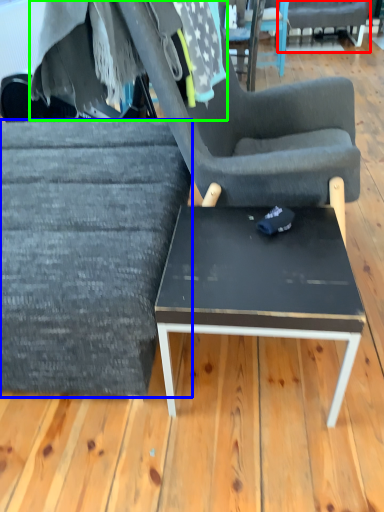
Question: Based on their relative distances, which object is farther from chair (highlighted by a red box)? Choose from chair (highlighted by a blue box) and fabric (highlighted by a green box).

Choices:
 (A) chair
 (B) fabric

Answer: (A)